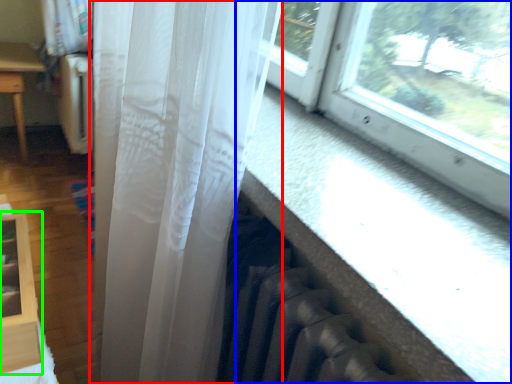
Question: Based on their relative distances, which object is farther from curtain (highlighted by a red box)? Choose from window (highlighted by a blue box) and shelf (highlighted by a green box).

Choices:
 (A) window
 (B) shelf

Answer: (B)